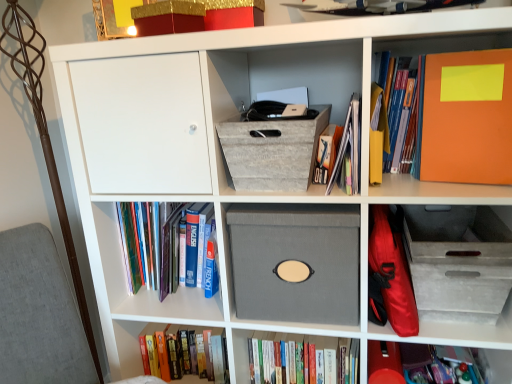
Question: Is point (216, 339) closer or farther from the camera than point (353, 127)?

Choices:
 (A) closer
 (B) farther

Answer: (B)

Question: Considering the relative positions of hardcover book at lower center, which ranks as the third book in bottom-to-top order, and matte orange folder at upper right, the fifth book positioned from the bottom, in the image provided, is hardcover book at lower center, which ranks as the third book in bottom-to-top order, to the left or to the right of matte orange folder at upper right, the fifth book positioned from the bottom,?

Choices:
 (A) right
 (B) left

Answer: (B)

Question: Estimate the real-world distances between objects in this image. Which object is closer to the hardcover book at upper right, which is counted as the 6th book, starting from the bottom?

Choices:
 (A) orange matte folder at upper right, the 1th paperback book when ordered from right to left
 (B) matte orange folder at upper right, the 2th book in the top-to-bottom sequence
 (C) yellow paper at upper right, which is the 1th paperback book from left to right
 (D) textured gray shoe box at center, the 3th shoe box viewed from the right
 (E) hardcover book at lower center, which is the sixth book in top-to-bottom order

Answer: (C)

Question: Based on their relative distances, which object is nearer to the orange matte folder at upper right, the 1th paperback book when ordered from right to left?

Choices:
 (A) hardcover book at lower center, which is the sixth book in top-to-bottom order
 (B) hardcover book at upper right, which is counted as the 6th book, starting from the bottom
 (C) hardcover books at left, the 3th book in the top-to-bottom sequence
 (D) matte red book at lower right, which ranks as the fifth book in top-to-bottom order
 (E) gray fabric shoe box at center, the second shoe box in the right-to-left sequence

Answer: (B)